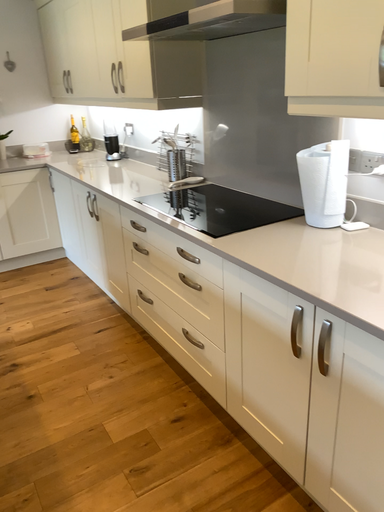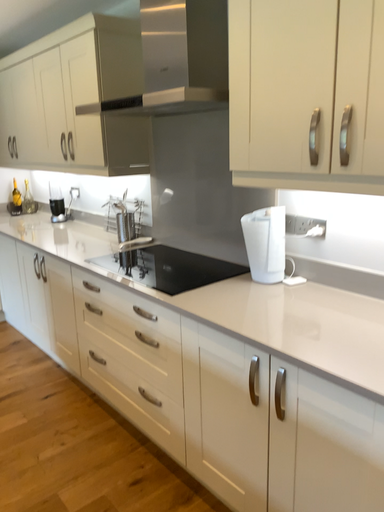
Question: How did the camera likely rotate when shooting the video?

Choices:
 (A) rotated left
 (B) rotated right

Answer: (B)